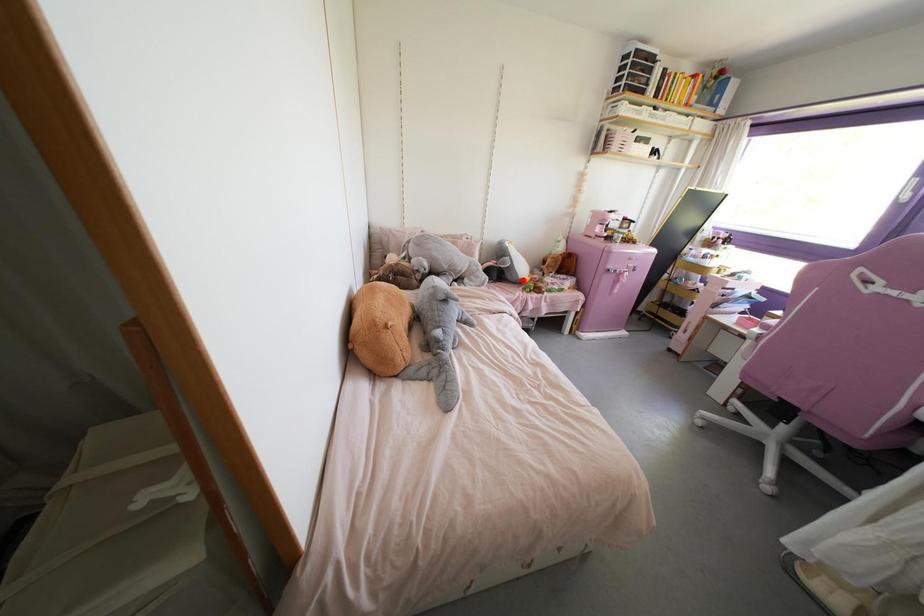
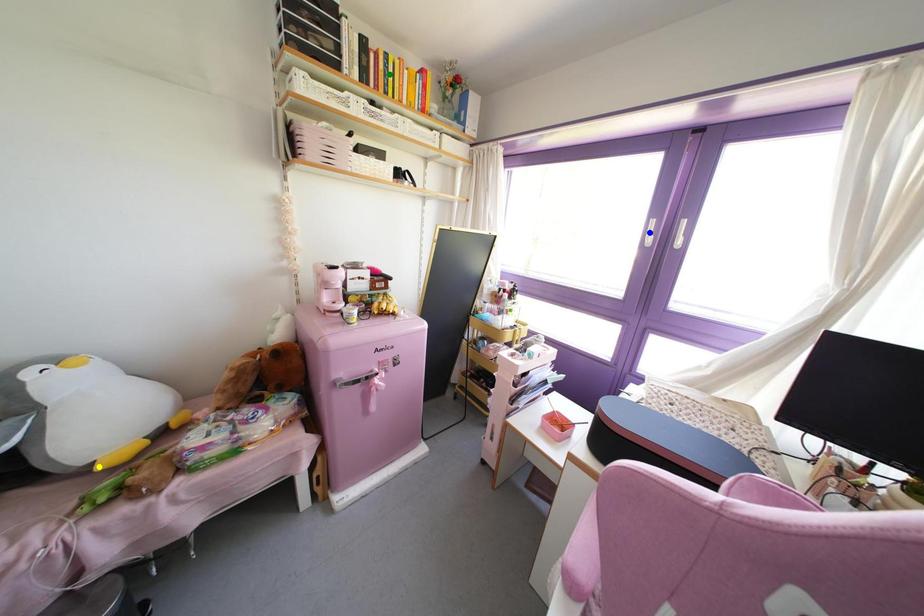
Question: I am providing you with two images of the same scene from different viewpoints. A red point is marked on the first image. You are given multiple points on the second image. Which point in image 2 is actually the same real-world point as the red point in image 1?

Choices:
 (A) yellow point
 (B) blue point
 (C) green point

Answer: (A)